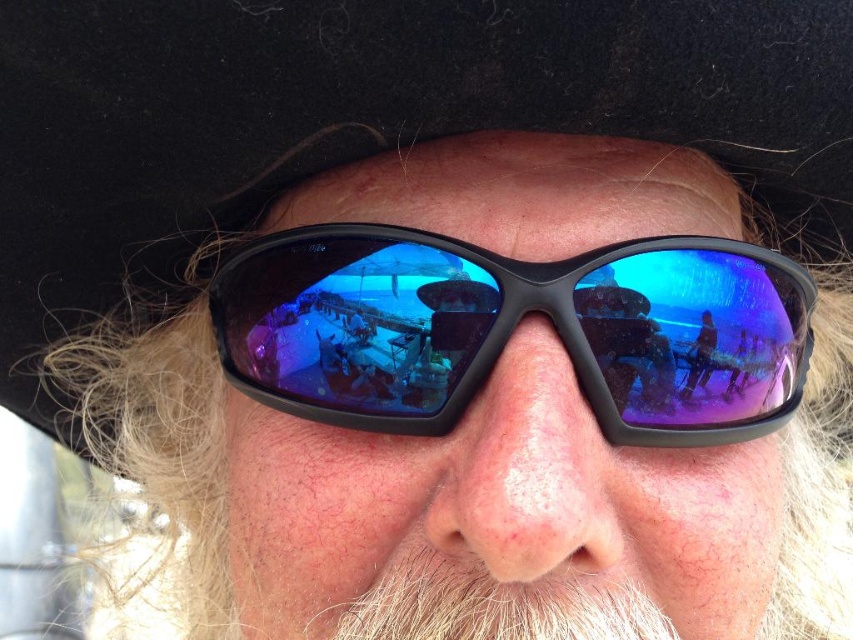
Consider the image. You are a photographer trying to capture the reflection in the black plastic sunglasses at center. The black felt cowboy hat at upper center is blocking your view. Can you move the hat to get a clearer shot of the sunglasses?

The black felt cowboy hat at upper center is larger in size than black plastic sunglasses at center, so moving the hat might be necessary to avoid blocking the view of the sunglasses.

You are holding a camera and want to take a photo of the person shown in the scene. The camera is currently positioned at point point (727, 131). The camera is 18.09 inches away from the person. If the camera has a focal length of 50mm, what is the approximate magnification factor needed to ensure the person fills the frame?

The magnification factor can be calculated using the formula magnification equals focal length divided by the distance. Here, the focal length is 50mm and the distance is 18.09 inches. Converting inches to millimeters, 18.09 inches is approximately 459.486 millimeters. Magnification equals 50 divided by 459.486, which is approximately 0.1086. To fill the frame, the magnification should be around 0.11 times.

You are a photographer trying to capture the reflection in the black plastic sunglasses at center. To ensure the reflection of the marina is visible, you need to adjust your position so that the black felt cowboy hat at upper center doesn t block your view. Is the hat positioned in a way that it might obstruct the reflection?

The black felt cowboy hat at upper center is located above the black plastic sunglasses at center, so it could potentially block the reflection in the sunglasses if positioned directly overhead. Adjust your angle to avoid the hat obstructing the view.